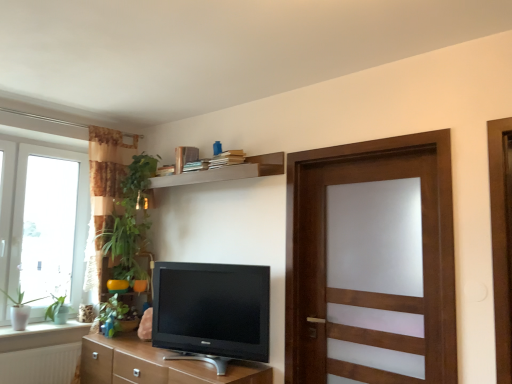
Locate an element on the screen. This screenshot has height=384, width=512. vacant space to the right of green matte plant at lower left, placed as the 2th plant when sorted from right to left is located at coordinates (133, 341).